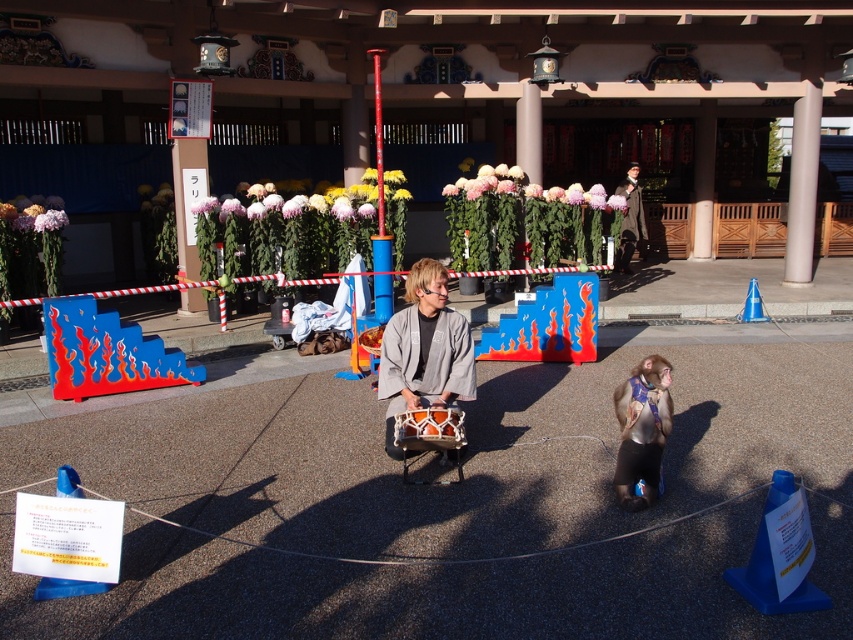
Question: Among these points, which one is nearest to the camera?

Choices:
 (A) (619, 244)
 (B) (421, 419)
 (C) (656, 388)
 (D) (407, 330)

Answer: (C)

Question: Can you confirm if metallic silver monkey at center is positioned to the right of orange glossy drum at center?

Choices:
 (A) yes
 (B) no

Answer: (A)

Question: Observing the image, what is the correct spatial positioning of gray fabric kimono at center in reference to metallic silver monkey at center?

Choices:
 (A) right
 (B) left

Answer: (B)

Question: Does metallic silver monkey at center appear over dark brown leather jacket at upper center?

Choices:
 (A) no
 (B) yes

Answer: (A)

Question: Based on their relative distances, which object is farther from the dark brown leather jacket at upper center?

Choices:
 (A) gray fabric kimono at center
 (B) orange glossy drum at center
 (C) metallic silver monkey at center

Answer: (B)

Question: Which point is farther from the camera taking this photo?

Choices:
 (A) (410, 424)
 (B) (630, 220)

Answer: (B)